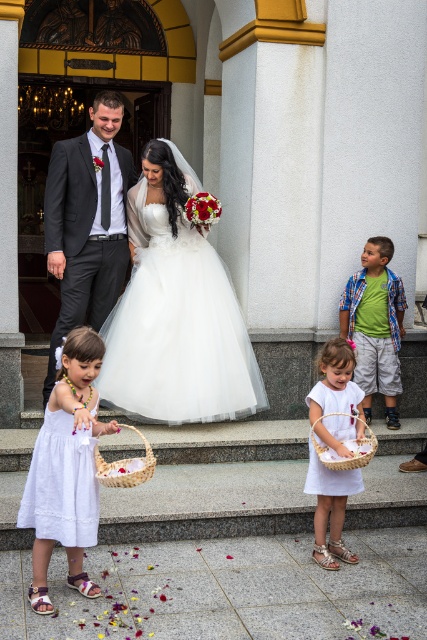
Question: Does matte black suit at left have a larger size compared to woven straw basket at lower center?

Choices:
 (A) no
 (B) yes

Answer: (B)

Question: Does white lace dress at lower left appear under white woven basket at lower center?

Choices:
 (A) no
 (B) yes

Answer: (A)

Question: Estimate the real-world distances between objects in this image. Which object is farther from the green cotton shirt at center?

Choices:
 (A) white woven basket at lower center
 (B) matte black suit at left
 (C) white cotton dress at lower left
 (D) white satin dress at center

Answer: (C)

Question: Among these points, which one is nearest to the camera?

Choices:
 (A) (131, 301)
 (B) (394, 394)
 (C) (98, 472)
 (D) (94, 499)

Answer: (D)

Question: Among these objects, which one is nearest to the camera?

Choices:
 (A) white satin dress at center
 (B) white cotton dress at lower left
 (C) green cotton shirt at center

Answer: (B)

Question: Can you confirm if white satin dress at center is bigger than green cotton shirt at center?

Choices:
 (A) yes
 (B) no

Answer: (A)